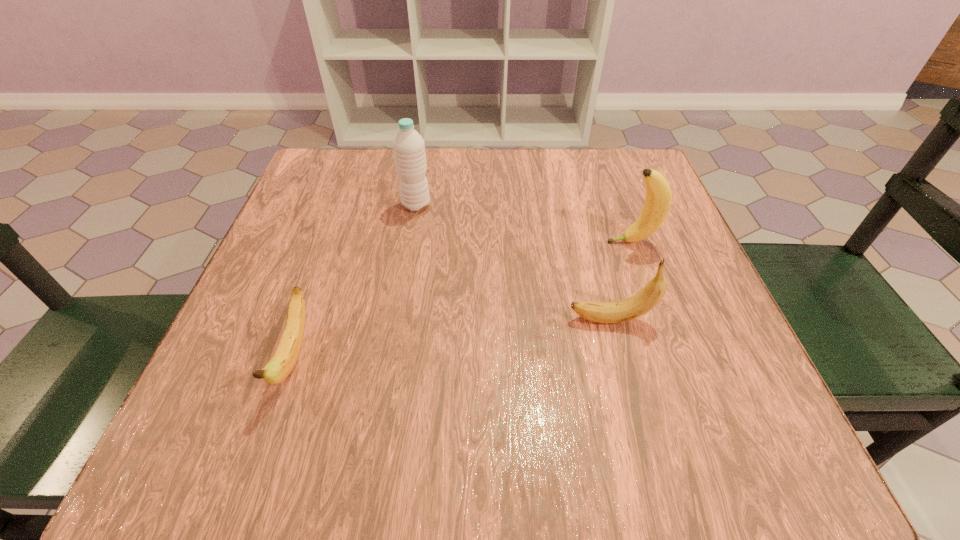
At what (x,y) coordinates should I click in order to perform the action: click on vacant region located from the stem of the farthest banana. Please return your answer as a coordinate pair (x, y). Looking at the image, I should click on (455, 242).

Identify the location of vacant space located 0.140m at the start of the peel on the third tallest object. This screenshot has height=540, width=960. (487, 320).

Where is `free location located 0.340m at the start of the peel on the third tallest object`? The image size is (960, 540). free location located 0.340m at the start of the peel on the third tallest object is located at coordinates (371, 320).

The height and width of the screenshot is (540, 960). I want to click on vacant space located 0.090m at the start of the peel on the third tallest object, so click(516, 320).

The height and width of the screenshot is (540, 960). In order to click on free space located at the stem of the leftmost banana in this screenshot , I will do [x=265, y=441].

Image resolution: width=960 pixels, height=540 pixels. I want to click on object situated at the far edge, so click(408, 146).

Where is `object that is at the left edge`? This screenshot has width=960, height=540. object that is at the left edge is located at coordinates (282, 363).

In the image, there is a desktop. Where is `vacant space at the far edge`? vacant space at the far edge is located at coordinates (516, 192).

At what (x,y) coordinates should I click in order to perform the action: click on vacant space at the left edge. Please return your answer as a coordinate pair (x, y). Image resolution: width=960 pixels, height=540 pixels. Looking at the image, I should click on (338, 233).

In the image, there is a desktop. Find the location of `blank space at the right edge`. blank space at the right edge is located at coordinates (730, 341).